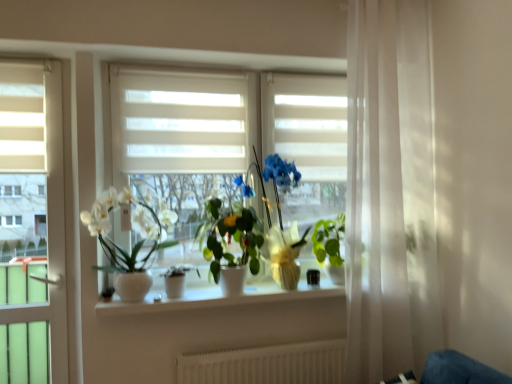
Identify the location of free point above white matte blind at upper left, acting as the second blind starting from the right (from a real-world perspective). Image resolution: width=512 pixels, height=384 pixels. (25, 60).